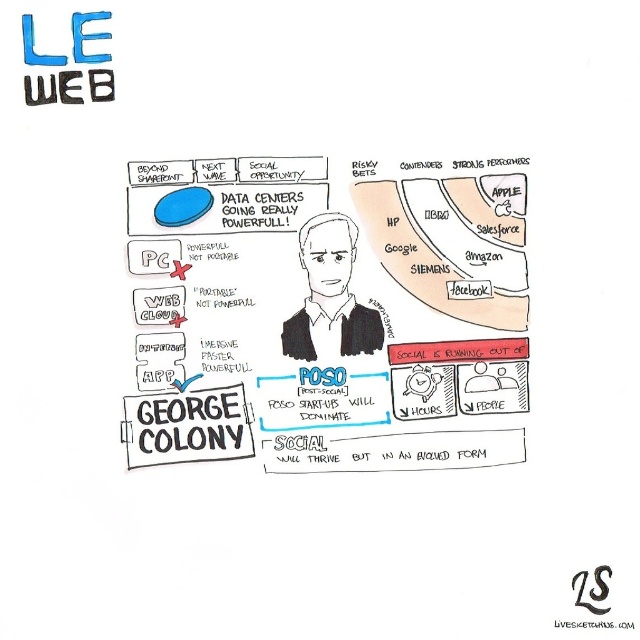
How much distance is there between matte black text at center and black matte portrait at center?

matte black text at center is 2.82 inches from black matte portrait at center.

Does matte black text at center have a lesser height compared to black matte portrait at center?

Incorrect, matte black text at center's height does not fall short of black matte portrait at center's.

Does point (221, 452) come behind point (298, 323)?

No, (221, 452) is in front of (298, 323).

Where is `matte black text at center`? The image size is (640, 640). matte black text at center is located at coordinates (324, 316).